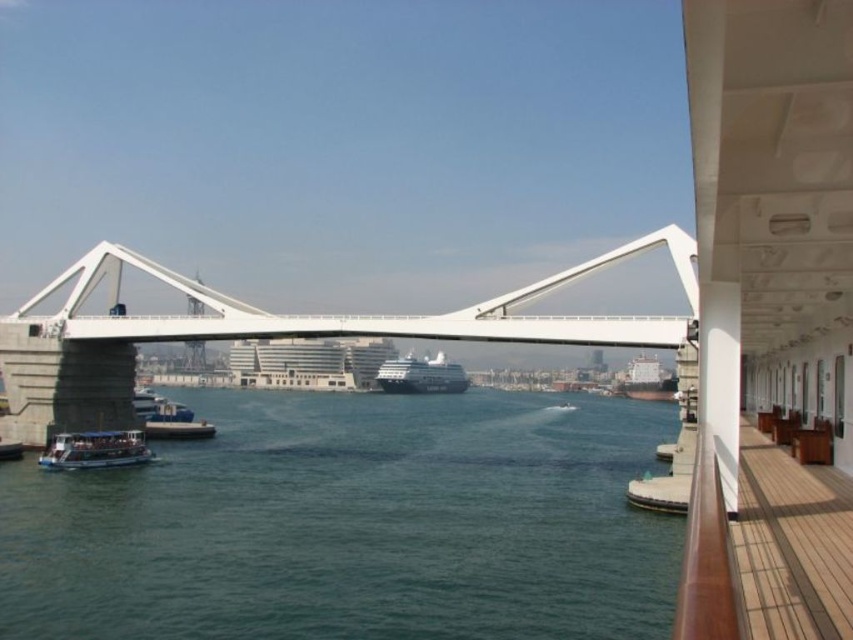
Question: Which point is farther to the camera?

Choices:
 (A) white metallic bridge at center
 (B) dark gray metallic ship at center

Answer: (B)

Question: Which point is farther from the camera taking this photo?

Choices:
 (A) (467, 532)
 (B) (119, 433)

Answer: (B)

Question: Which object appears closest to the camera in this image?

Choices:
 (A) brown wooden deck at right
 (B) green matte boat at lower left

Answer: (A)

Question: Considering the relative positions of brown wooden deck at right and green matte boat at lower left in the image provided, where is brown wooden deck at right located with respect to green matte boat at lower left?

Choices:
 (A) above
 (B) below

Answer: (A)

Question: Is brown wooden deck at right behind dark gray metallic ship at center?

Choices:
 (A) yes
 (B) no

Answer: (B)

Question: Can you confirm if white metallic bridge at center is bigger than dark gray metallic ship at center?

Choices:
 (A) yes
 (B) no

Answer: (A)